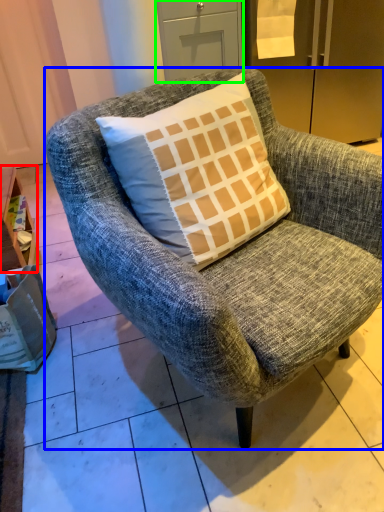
Question: Estimate the real-world distances between objects in this image. Which object is closer to table (highlighted by a red box), chair (highlighted by a blue box) or drawer (highlighted by a green box)?

Choices:
 (A) chair
 (B) drawer

Answer: (A)